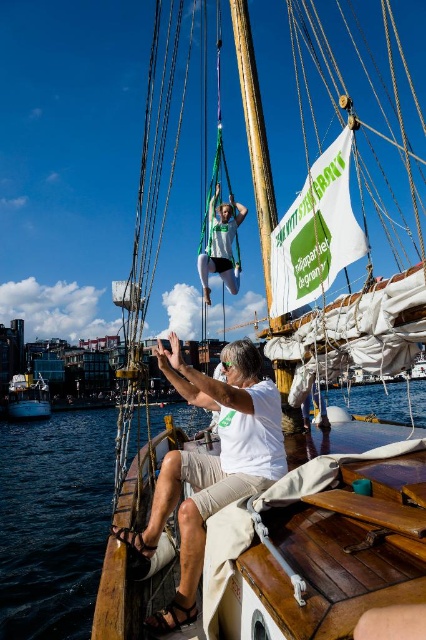
Locate an element on the screen. The height and width of the screenshot is (640, 426). white cotton shirt at center is located at coordinates (212, 461).

Who is more forward, (192, 502) or (247, 84)?

Point (192, 502)

Is point (169, 340) closer to camera compared to point (268, 225)?

No, (169, 340) is further to viewer.

In order to click on white cotton shirt at center in this screenshot , I will do `click(212, 461)`.

Does wooden mast at upper center come behind green fabric harness at center?

No, it is not.

Is wooden mast at upper center positioned before green fabric harness at center?

That is True.

Does point (255, 67) come behind point (203, 253)?

That is False.

The height and width of the screenshot is (640, 426). I want to click on wooden mast at upper center, so click(x=255, y=134).

Is dark blue water at lower left smaller than green fabric harness at center?

Actually, dark blue water at lower left might be larger than green fabric harness at center.

What do you see at coordinates (54, 522) in the screenshot? I see `dark blue water at lower left` at bounding box center [54, 522].

Between point (80, 596) and point (213, 198), which one is positioned in front?

Point (213, 198)

This screenshot has height=640, width=426. Identify the location of dark blue water at lower left. (54, 522).